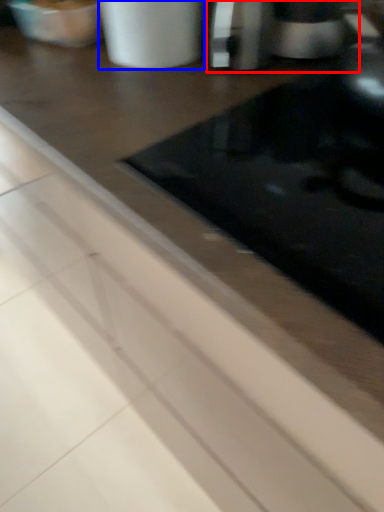
Question: Which object is further to the camera taking this photo, coffee machine (highlighted by a red box) or appliance (highlighted by a blue box)?

Choices:
 (A) coffee machine
 (B) appliance

Answer: (A)